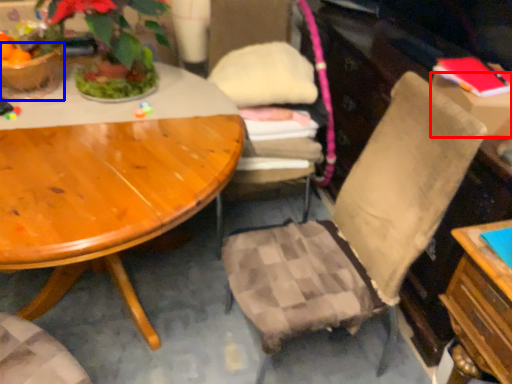
Question: Which of the following is the farthest to the observer, box (highlighted by a red box) or flowerpot (highlighted by a blue box)?

Choices:
 (A) box
 (B) flowerpot

Answer: (B)